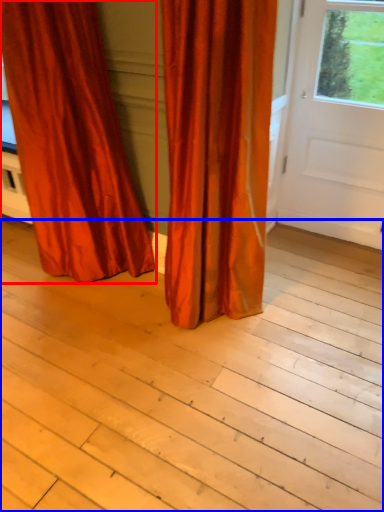
Question: Which of the following is the farthest to the observer, curtain (highlighted by a red box) or plank (highlighted by a blue box)?

Choices:
 (A) curtain
 (B) plank

Answer: (A)